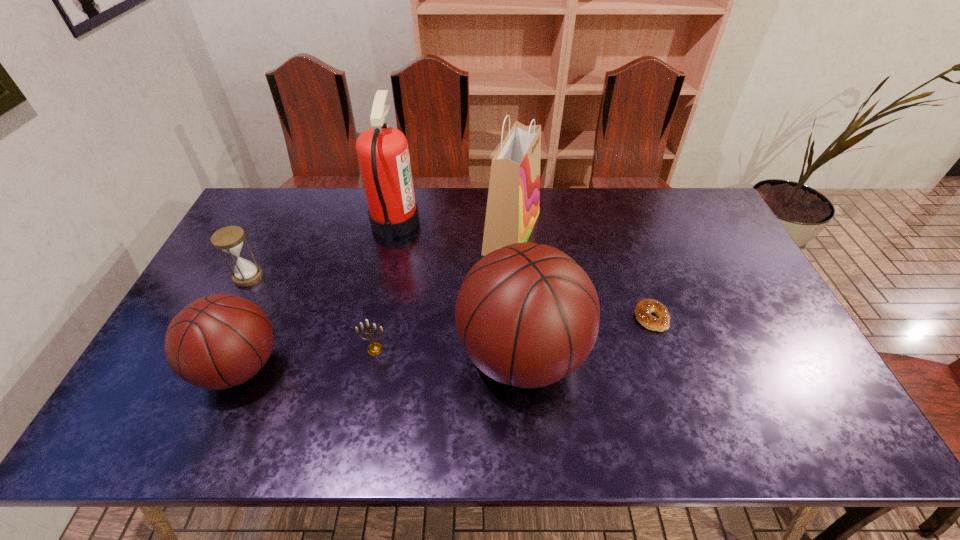
At what (x,y) coordinates should I click in order to perform the action: click on basketball present at the left edge. Please return your answer as a coordinate pair (x, y). This screenshot has width=960, height=540. Looking at the image, I should click on (216, 342).

Locate an element on the screen. Image resolution: width=960 pixels, height=540 pixels. hourglass that is at the left edge is located at coordinates (229, 239).

Locate an element on the screen. This screenshot has height=540, width=960. object at the near left corner is located at coordinates (216, 342).

Identify the location of vacant area at the far edge. Image resolution: width=960 pixels, height=540 pixels. pos(456,198).

Locate an element on the screen. The width and height of the screenshot is (960, 540). free space at the near edge is located at coordinates (569, 390).

The height and width of the screenshot is (540, 960). Find the location of `blank area at the far right corner`. blank area at the far right corner is located at coordinates (709, 217).

Locate an element on the screen. free space between the fire extinguisher and the shorter basketball is located at coordinates (318, 294).

Locate an element on the screen. This screenshot has height=540, width=960. vacant area that lies between the shortest object and the fifth tallest object is located at coordinates (450, 297).

This screenshot has width=960, height=540. I want to click on unoccupied area between the fire extinguisher and the shorter basketball, so tap(318, 294).

This screenshot has width=960, height=540. In order to click on vacant space that is in between the fire extinguisher and the right basketball in this screenshot , I will do `click(459, 288)`.